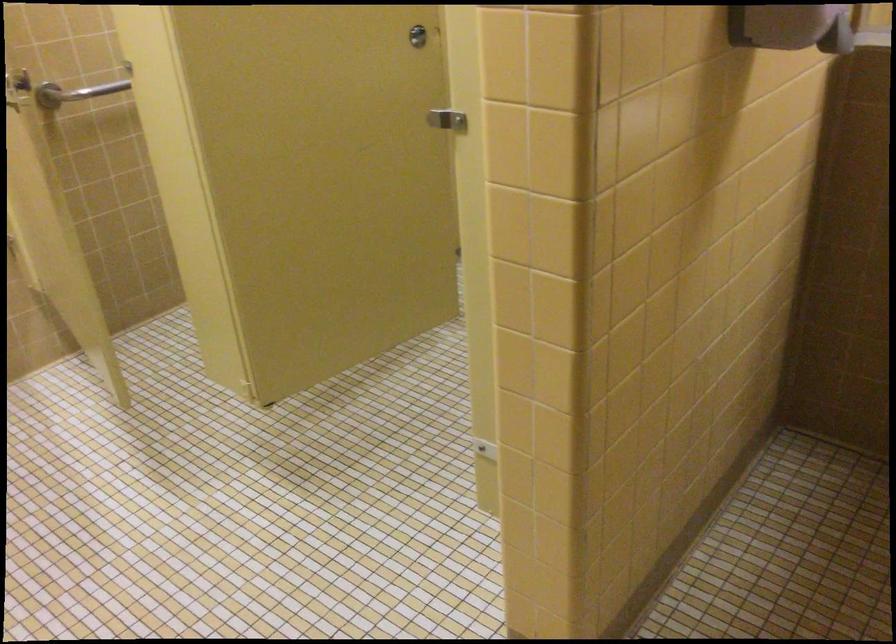
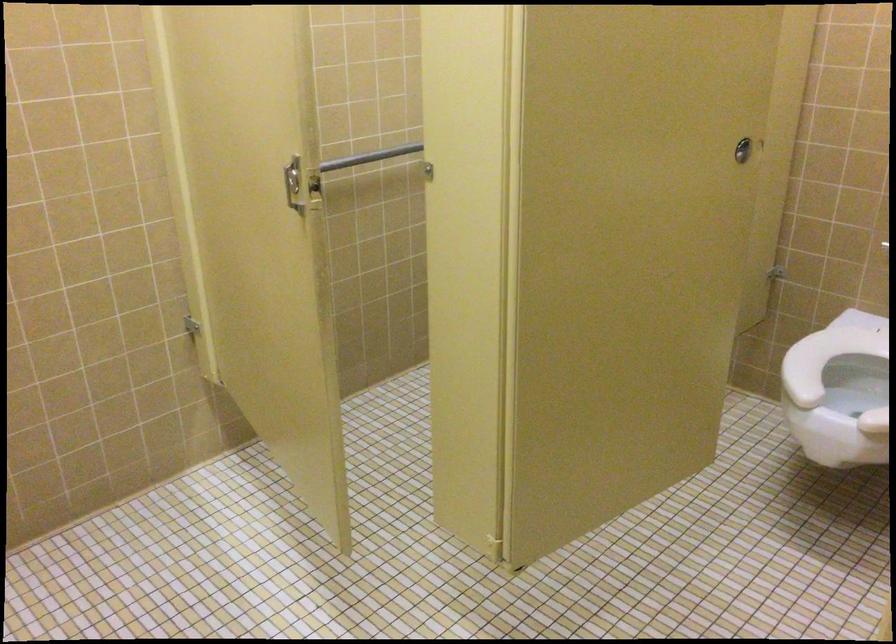
Question: I am providing you with two images of the same scene from different viewpoints. After the viewpoint changes to image2, which objects are now occluded?

Choices:
 (A) silver door lock
 (B) grey patterned cushion
 (C) white toilet seat
 (D) metal grab bar

Answer: (D)